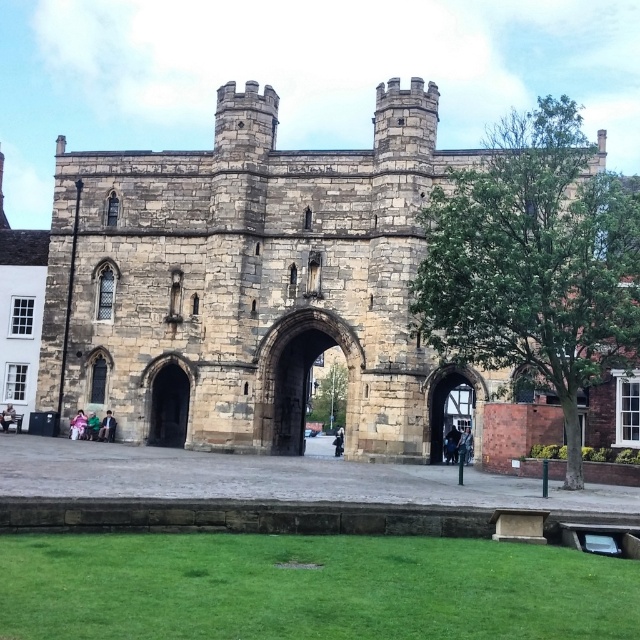
You are a visitor standing in front of the historic stone structure. You want to walk through the dark stone archway at center. Can you pass through it comfortably? Consider the width of the archway compared to the dark gray stone person at center.

The dark stone archway at center might be wider than dark gray stone stone person at center, so it is possible that the archway is wide enough for you to pass through comfortably.

You are a visitor standing in front of the stone castle at center and the light pink fabric at lower left. Which object is taller?

The stone castle at center is taller than the light pink fabric at lower left.